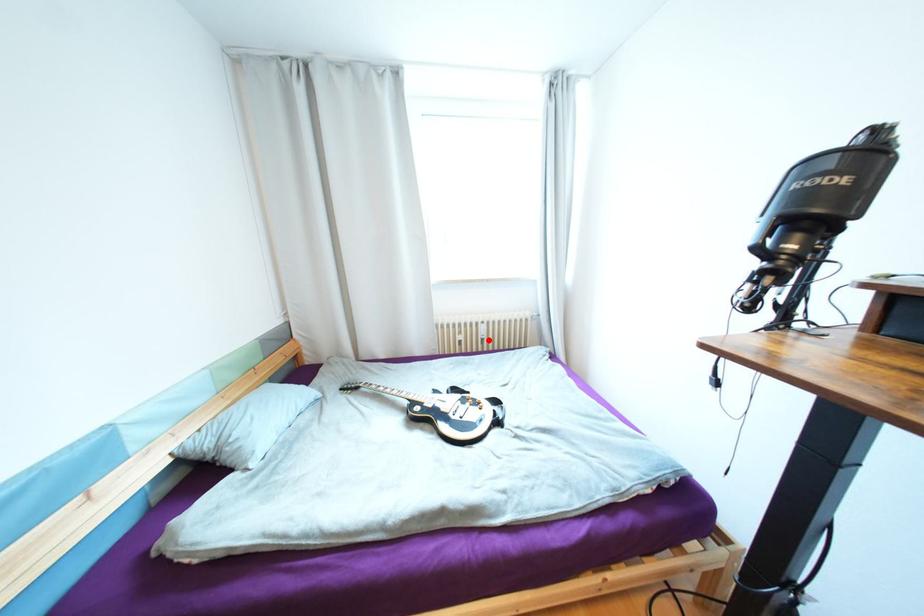
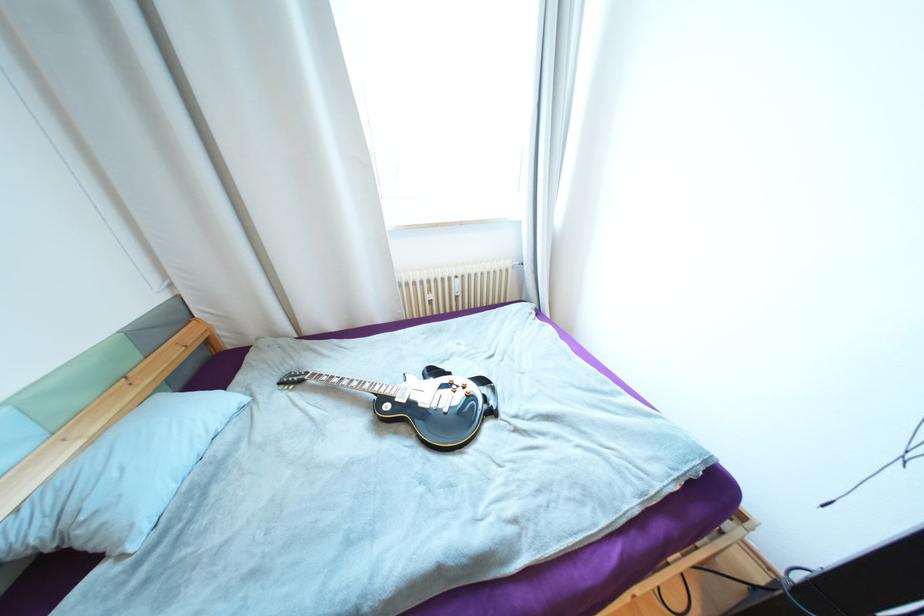
Question: I am providing you with two images of the same scene from different viewpoints. A red point is shown in image1. For the corresponding object point in image2, is it positioned nearer or farther from the camera?

Choices:
 (A) Nearer
 (B) Farther

Answer: (A)